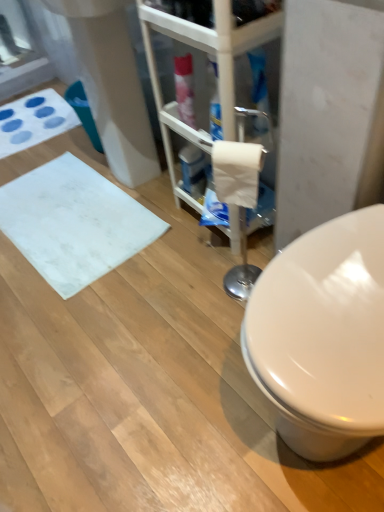
Question: Is white matte bath mat at upper left, the 2th bath mat when ordered from bottom to top, oriented towards white matte toilet paper at center?

Choices:
 (A) yes
 (B) no

Answer: (B)

Question: Does white matte bath mat at upper left, the first bath mat when ordered from back to front, have a larger size compared to white matte toilet paper at center?

Choices:
 (A) yes
 (B) no

Answer: (A)

Question: Is white matte bath mat at upper left, placed as the first bath mat when sorted from top to bottom, facing away from white matte toilet paper at center?

Choices:
 (A) no
 (B) yes

Answer: (A)

Question: Does white matte bath mat at upper left, the 2th bath mat when ordered from bottom to top, appear on the right side of white matte toilet paper at center?

Choices:
 (A) yes
 (B) no

Answer: (B)

Question: From the image's perspective, is white matte bath mat at upper left, positioned as the 2th bath mat in front-to-back order, below white matte toilet paper at center?

Choices:
 (A) yes
 (B) no

Answer: (B)

Question: Is white matte bath mat at upper left, the 2th bath mat when ordered from bottom to top, further to camera compared to white matte toilet paper at center?

Choices:
 (A) no
 (B) yes

Answer: (B)

Question: From a real-world perspective, is white matte toilet paper at center under white matte bath mat at upper left, the 2th bath mat when ordered from bottom to top?

Choices:
 (A) no
 (B) yes

Answer: (A)

Question: Is white matte toilet paper at center bigger than white matte bath mat at upper left, placed as the first bath mat when sorted from top to bottom?

Choices:
 (A) yes
 (B) no

Answer: (B)

Question: Can you confirm if white matte toilet paper at center is taller than white matte bath mat at upper left, placed as the first bath mat when sorted from top to bottom?

Choices:
 (A) no
 (B) yes

Answer: (B)

Question: Is white matte toilet paper at center at the left side of white matte bath mat at upper left, the 2th bath mat when ordered from bottom to top?

Choices:
 (A) yes
 (B) no

Answer: (B)

Question: Considering the relative sizes of white matte toilet paper at center and white matte bath mat at upper left, the first bath mat when ordered from back to front, in the image provided, is white matte toilet paper at center smaller than white matte bath mat at upper left, the first bath mat when ordered from back to front,?

Choices:
 (A) yes
 (B) no

Answer: (A)

Question: Can white matte bath mat at upper left, positioned as the 2th bath mat in front-to-back order, be found inside white matte toilet paper at center?

Choices:
 (A) yes
 (B) no

Answer: (B)

Question: Can we say white matte bath mat at lower left, the 1th bath mat viewed from the front, lies outside white matte toilet paper at center?

Choices:
 (A) yes
 (B) no

Answer: (A)